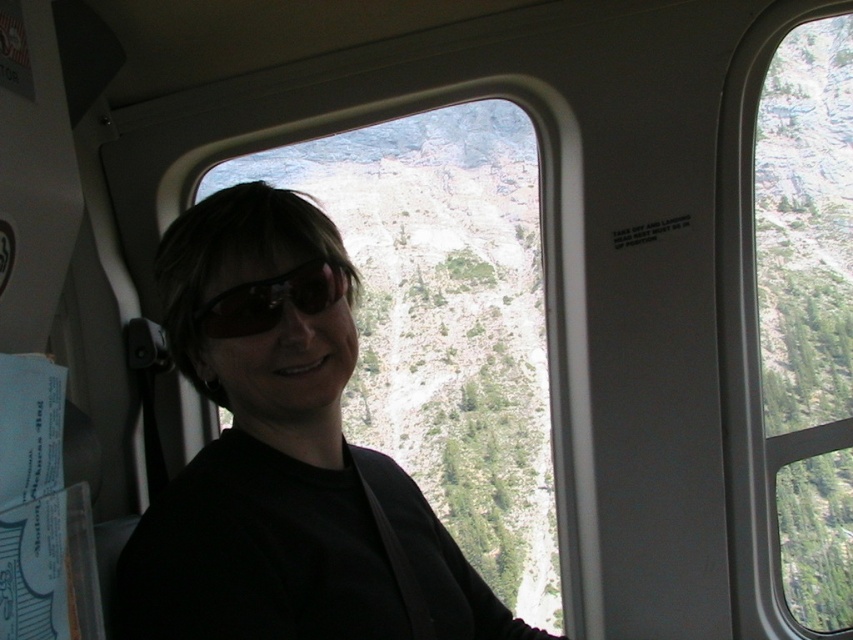
You are a flight attendant in a helicopter cabin. You need to hand a safety manual to the passenger wearing the matte black shirt at center. The manual is on the seat next to the black reflective sunglasses at center. Can you reach the manual without moving the sunglasses?

The distance between the matte black shirt at center and the black reflective sunglasses at center is 20.64 inches. Since the manual is on the seat next to the sunglasses, you can reach it without moving the sunglasses as they are separate items on the seat.

You are a passenger in the helicopter and want to take a photo of the mountain view through the window. You have two points on the window where you can place your camera. The points are labeled as point (x=190, y=588) and point (x=207, y=314). Which point should you choose to ensure your camera is closer to the window for a clearer shot?

Point (x=190, y=588) is closer to the camera than point (x=207, y=314), so you should choose point (x=190, y=588) to ensure your camera is closer to the window for a clearer shot.